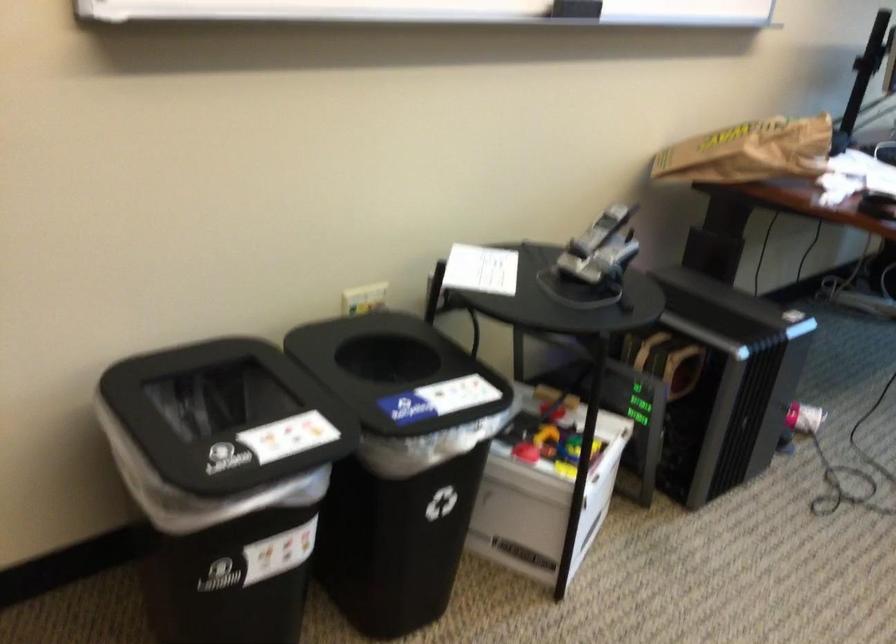
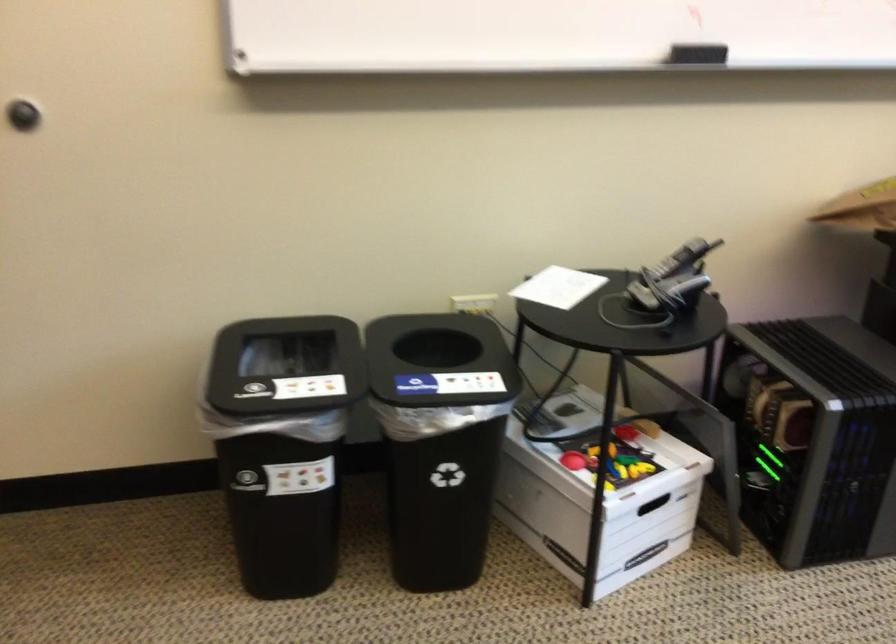
Where in the second image is the point corresponding to (179,413) from the first image?

(286, 366)